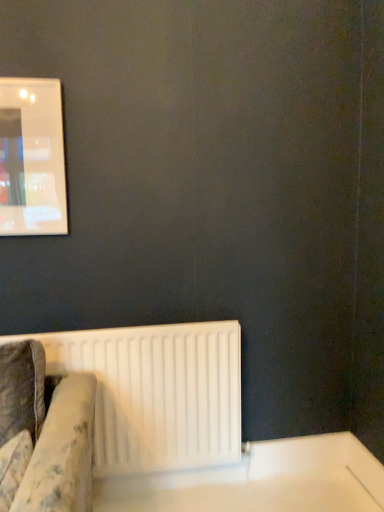
Question: Is white glossy table at lower right next to white plastic radiator at lower left and touching it?

Choices:
 (A) yes
 (B) no

Answer: (B)

Question: Can you confirm if white glossy table at lower right is smaller than white plastic radiator at lower left?

Choices:
 (A) no
 (B) yes

Answer: (B)

Question: Is white glossy table at lower right outside of white plastic radiator at lower left?

Choices:
 (A) yes
 (B) no

Answer: (A)

Question: Can you confirm if white glossy table at lower right is wider than white plastic radiator at lower left?

Choices:
 (A) yes
 (B) no

Answer: (A)

Question: Does white glossy table at lower right have a lesser width compared to white plastic radiator at lower left?

Choices:
 (A) no
 (B) yes

Answer: (A)

Question: Does white glossy table at lower right appear on the left side of white plastic radiator at lower left?

Choices:
 (A) no
 (B) yes

Answer: (A)

Question: Is white plastic radiator at lower left touching white glossy table at lower right?

Choices:
 (A) yes
 (B) no

Answer: (B)

Question: Is white plastic radiator at lower left wider than white glossy table at lower right?

Choices:
 (A) no
 (B) yes

Answer: (A)

Question: Can you confirm if white plastic radiator at lower left is positioned to the right of white glossy table at lower right?

Choices:
 (A) yes
 (B) no

Answer: (B)

Question: Considering the relative positions of white plastic radiator at lower left and white glossy table at lower right in the image provided, is white plastic radiator at lower left behind white glossy table at lower right?

Choices:
 (A) yes
 (B) no

Answer: (A)

Question: From the image's perspective, is white plastic radiator at lower left under white glossy table at lower right?

Choices:
 (A) yes
 (B) no

Answer: (B)

Question: Is there a large distance between white plastic radiator at lower left and white glossy table at lower right?

Choices:
 (A) no
 (B) yes

Answer: (A)

Question: Is point (139, 467) positioned closer to the camera than point (360, 461)?

Choices:
 (A) closer
 (B) farther

Answer: (A)